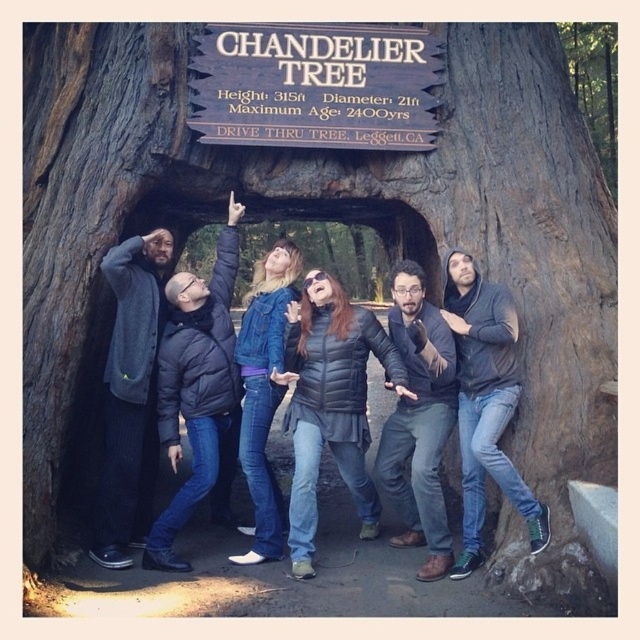
You are standing in front of the Chandelier Tree and see two people wearing dark gray hoodie at center and dark gray puffer jacket at center. Which one is positioned to the right?

The dark gray hoodie at center is positioned to the right of the dark gray puffer jacket at center.

From the picture: You are standing at the point marked by the coordinates point (332, 404). What object is located at that point?

The point (332, 404) marks the location of the matte black jacket at center.